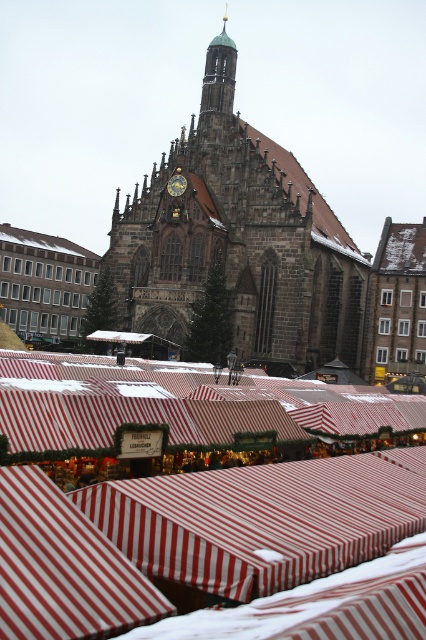
You are standing at the center of the market and want to find the red striped awning at center. According to the coordinates provided, where should you look relative to your current position?

The red striped awning at center is located at coordinates point (x=173, y=502), which means it is positioned to the right and slightly above your current position at the center of the market.

You are a vendor at the market and want to set up a new stall. The new stall requires a space wider than the red striped awning at center. Can you place it under the dark brown stone church at center?

The red striped awning at center has a lesser width compared to dark brown stone church at center, so yes, the new stall can be placed under the dark brown stone church at center since it is wider than the red striped awning at center.